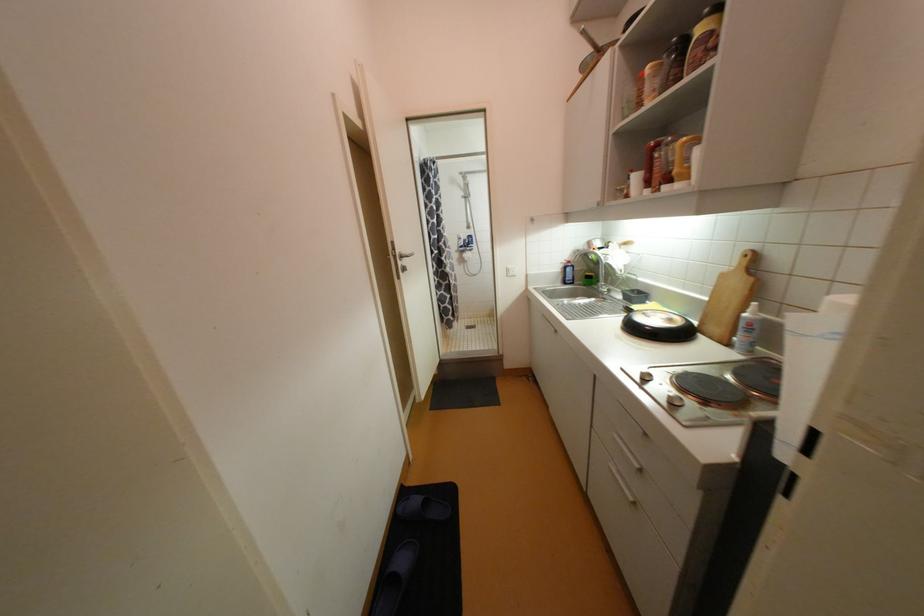
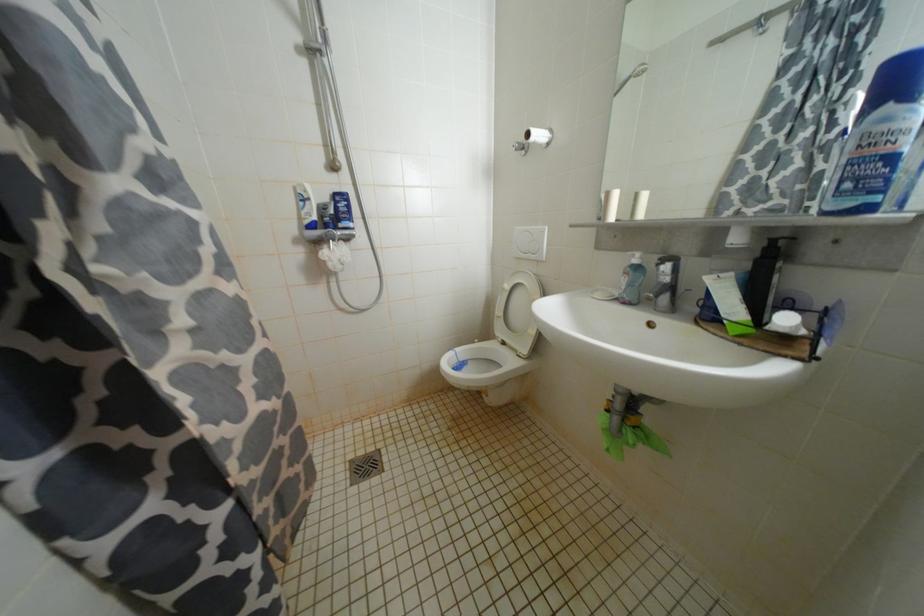
Question: What movement of the cameraman would produce the second image?

Choices:
 (A) Left
 (B) Right
 (C) Forward
 (D) Backward

Answer: (C)